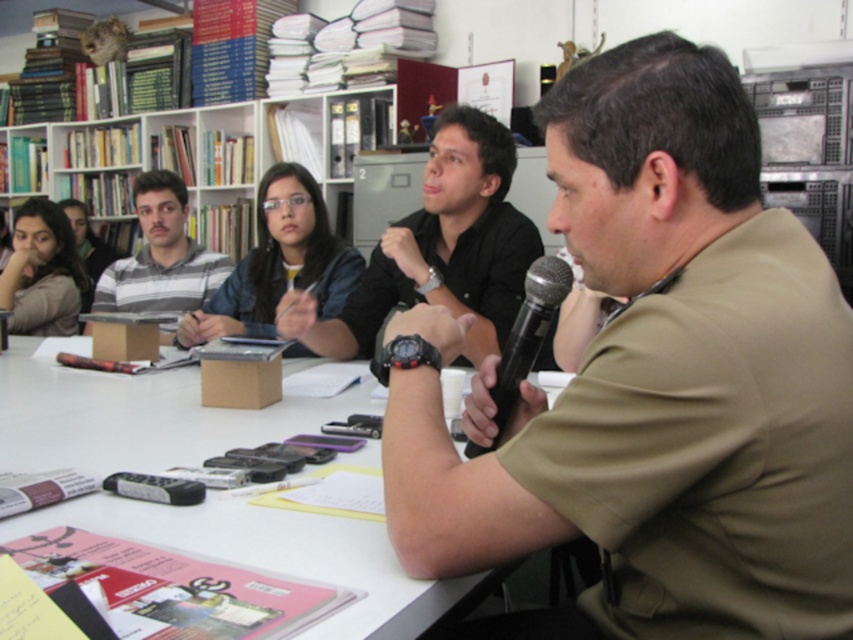
You are a speaker who needs to reach both the white paper at center and the black metallic microphone at center during your presentation. If your arm can extend 20 inches, can you comfortably reach both items without moving your chair?

The distance between the white paper at center and the black metallic microphone at center is 22.48 inches. Since your arm can only extend 20 inches, you cannot comfortably reach both items without moving your chair.

You are a photographer standing behind the table in the scene. You want to take a photo of both the khaki shirt at center and the black matte shirt at center without any obstructions. Given that your camera has a maximum focus range of 35 inches, will you be able to capture both subjects in focus?

The distance between the khaki shirt at center and the black matte shirt at center is 34.99 inches, which is within the camera maximum focus range of 35 inches. Therefore, both subjects can be captured in focus.